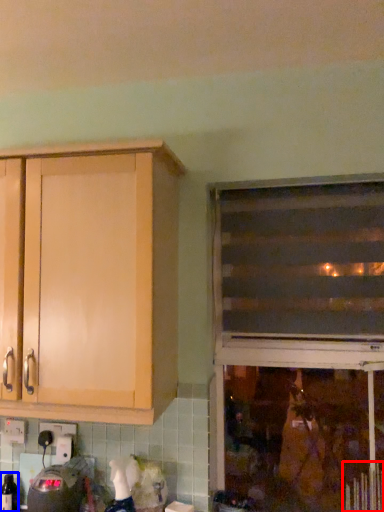
Question: Which object appears farthest to the camera in this image, radiator (highlighted by a red box) or bottle (highlighted by a blue box)?

Choices:
 (A) radiator
 (B) bottle

Answer: (B)